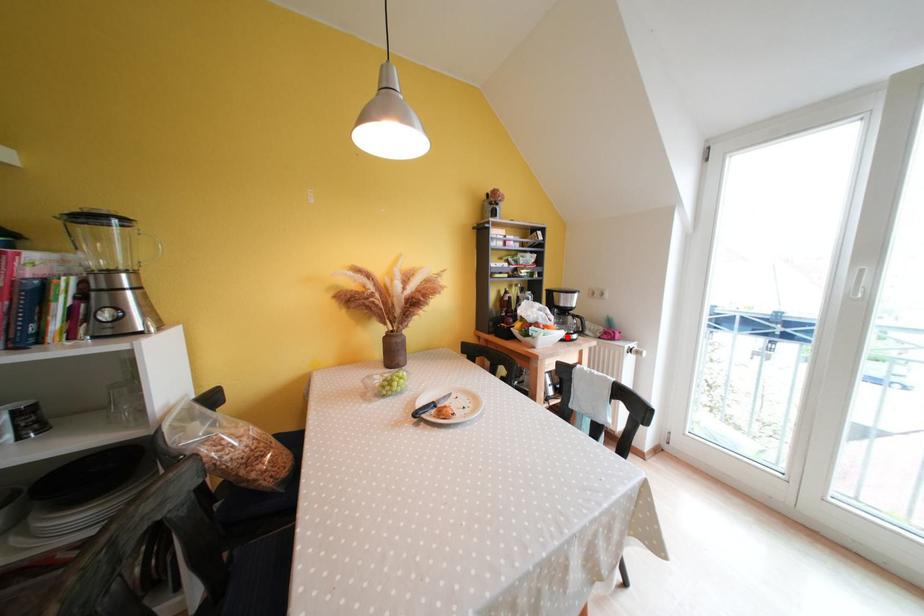
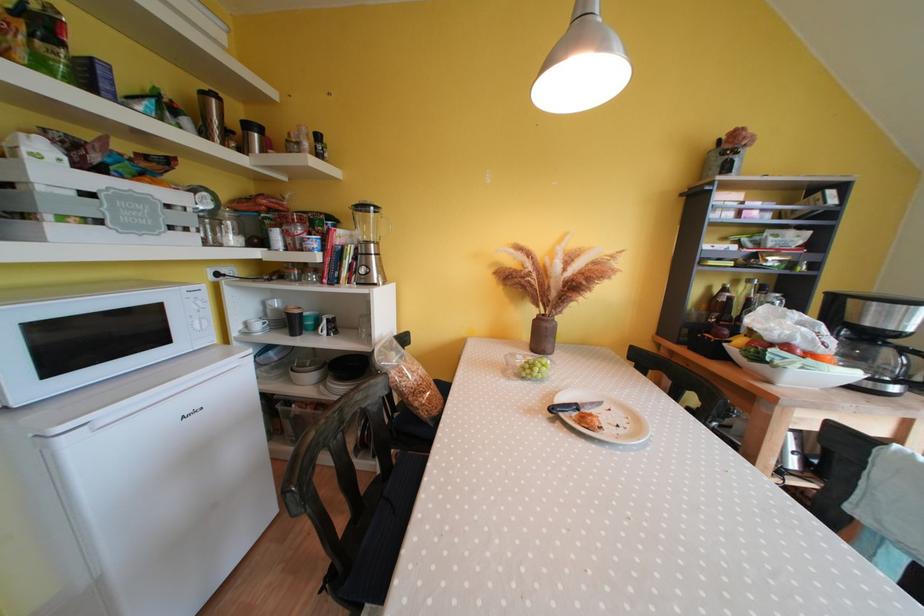
Where in the second image is the point corresponding to the highlighted location from the first image?

(858, 378)